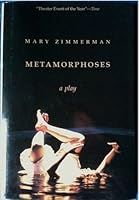
What are the coordinates of `book` in the screenshot? It's located at (123, 96).